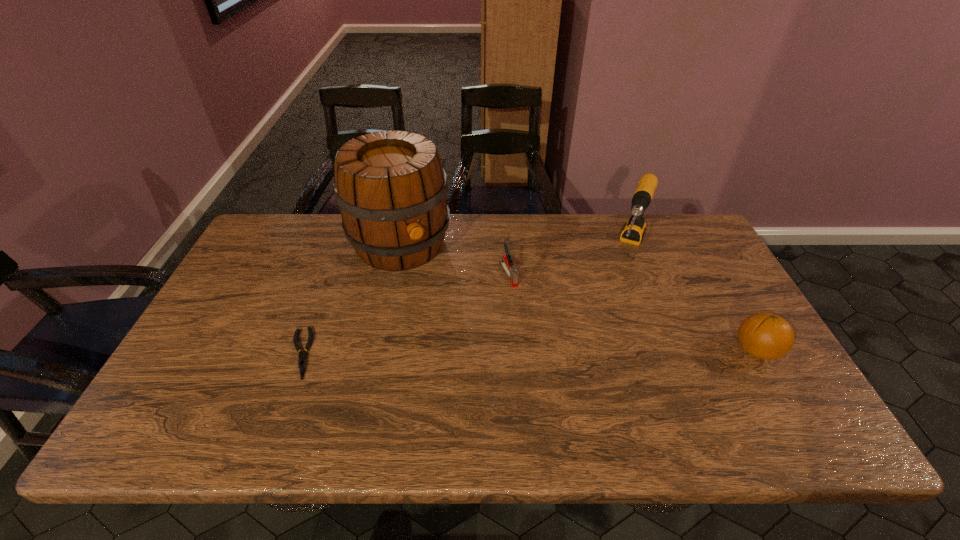
At what (x,y) coordinates should I click in order to perform the action: click on vacant space on the desktop that is between the pliers and the orange and is positioned on the handle side of the third object from right to left. Please return your answer as a coordinate pair (x, y). Looking at the image, I should click on (554, 352).

This screenshot has width=960, height=540. Identify the location of vacant space on the desktop that is between the pliers and the orange and is positioned on the handle side of the second tallest object. (589, 352).

The image size is (960, 540). Identify the location of vacant space on the desktop that is between the pliers and the rightmost object and is positioned on the side of the tallest object where the spigot is located. (469, 352).